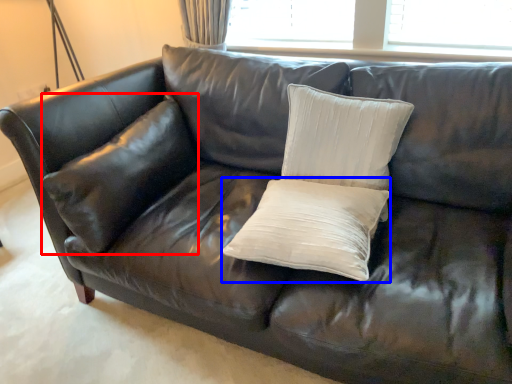
Question: Which object is closer to the camera taking this photo, pillow (highlighted by a red box) or pillow (highlighted by a blue box)?

Choices:
 (A) pillow
 (B) pillow

Answer: (B)